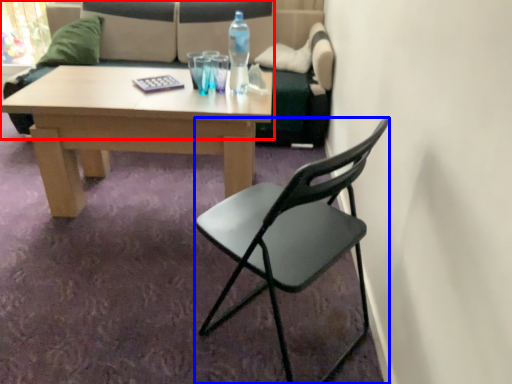
Question: Which of the following is the farthest to the observer, studio couch (highlighted by a red box) or chair (highlighted by a blue box)?

Choices:
 (A) studio couch
 (B) chair

Answer: (A)